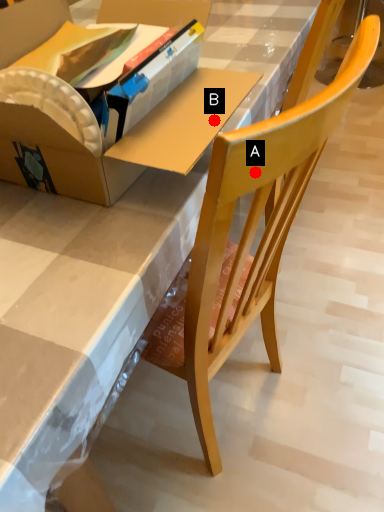
Question: Two points are circled on the image, labeled by A and B beside each circle. Among these points, which one is farthest from the camera?

Choices:
 (A) A is further
 (B) B is further

Answer: (B)